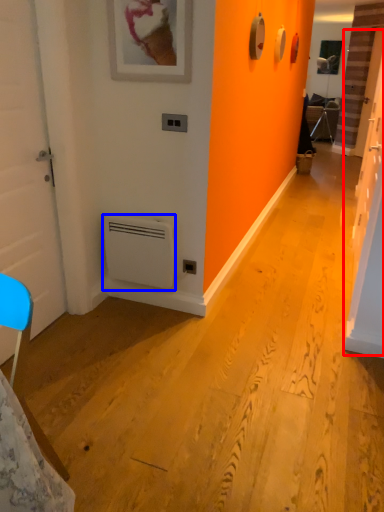
Question: Which of the following is the closest to the observer, door (highlighted by a red box) or air conditioning (highlighted by a blue box)?

Choices:
 (A) door
 (B) air conditioning

Answer: (A)